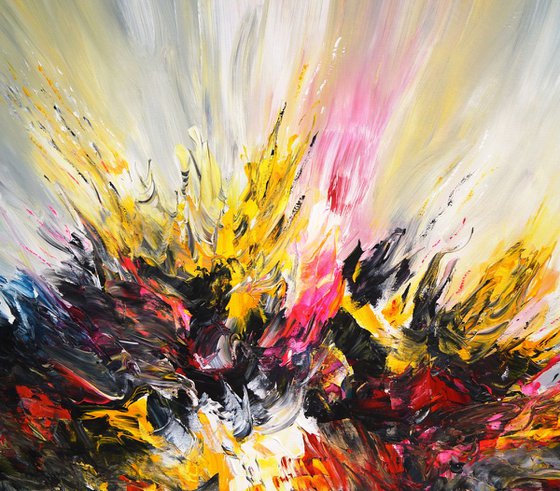
Find the location of a particular element. This screenshot has height=491, width=560. painting is located at coordinates (326, 210).